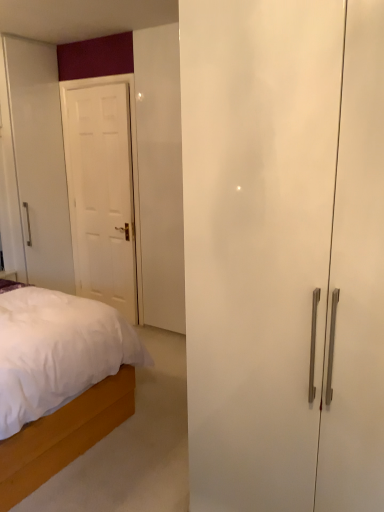
Question: Can you confirm if white wooden bed at lower left is positioned to the right of white glossy door at left?

Choices:
 (A) no
 (B) yes

Answer: (A)

Question: Considering the relative sizes of white wooden bed at lower left and white glossy door at left in the image provided, is white wooden bed at lower left smaller than white glossy door at left?

Choices:
 (A) yes
 (B) no

Answer: (B)

Question: Would you say white glossy door at left is part of white wooden bed at lower left's contents?

Choices:
 (A) no
 (B) yes

Answer: (A)

Question: Considering the relative positions of white wooden bed at lower left and white glossy door at left in the image provided, is white wooden bed at lower left in front of white glossy door at left?

Choices:
 (A) no
 (B) yes

Answer: (B)

Question: From the image's perspective, is white wooden bed at lower left located beneath white glossy door at left?

Choices:
 (A) yes
 (B) no

Answer: (A)

Question: Considering the relative sizes of white wooden bed at lower left and white glossy door at left in the image provided, is white wooden bed at lower left wider than white glossy door at left?

Choices:
 (A) no
 (B) yes

Answer: (B)

Question: Considering the relative sizes of white glossy door at left and white wooden bed at lower left in the image provided, is white glossy door at left thinner than white wooden bed at lower left?

Choices:
 (A) no
 (B) yes

Answer: (B)

Question: Is white glossy door at left directly adjacent to white wooden bed at lower left?

Choices:
 (A) yes
 (B) no

Answer: (B)

Question: From a real-world perspective, is white glossy door at left positioned under white wooden bed at lower left based on gravity?

Choices:
 (A) yes
 (B) no

Answer: (B)

Question: Considering the relative sizes of white glossy door at left and white wooden bed at lower left in the image provided, is white glossy door at left taller than white wooden bed at lower left?

Choices:
 (A) no
 (B) yes

Answer: (B)

Question: Is white glossy door at left far away from white wooden bed at lower left?

Choices:
 (A) no
 (B) yes

Answer: (B)

Question: Is white wooden bed at lower left completely or partially inside white glossy door at left?

Choices:
 (A) no
 (B) yes

Answer: (A)

Question: From their relative heights in the image, would you say white glossy door at left is taller or shorter than white wooden bed at lower left?

Choices:
 (A) short
 (B) tall

Answer: (B)